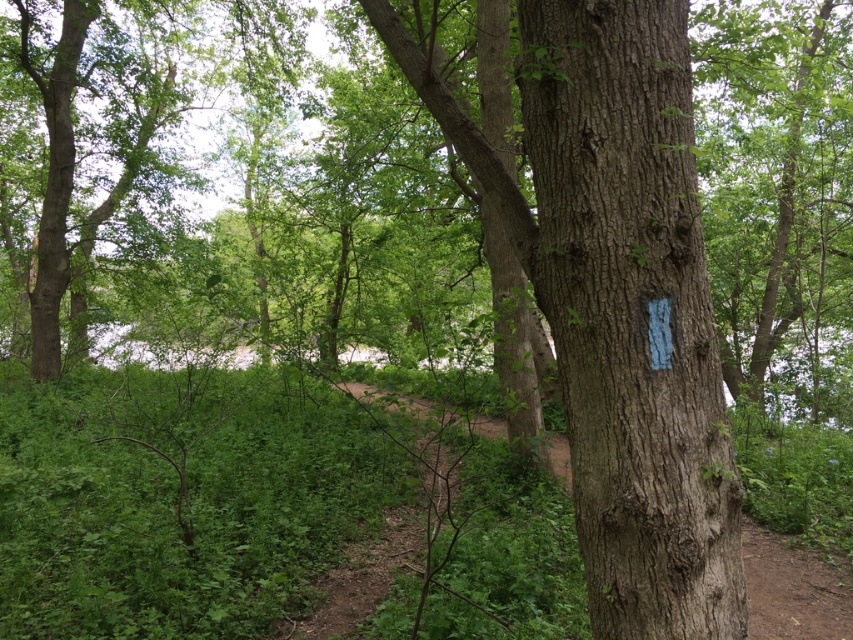
You are a hiker trying to identify the narrowest part of the tree in the forest scene. Which object between the smooth bark tree trunk at center and the smooth bark tree at center is narrower?

The smooth bark tree trunk at center is narrower than the smooth bark tree at center.

You are navigating through the forest and need to locate the smooth bark tree trunk at center. According to the coordinates provided, where exactly is it positioned?

The smooth bark tree trunk at center is located at point (631, 314), which means it is positioned near the center of the image slightly towards the bottom.